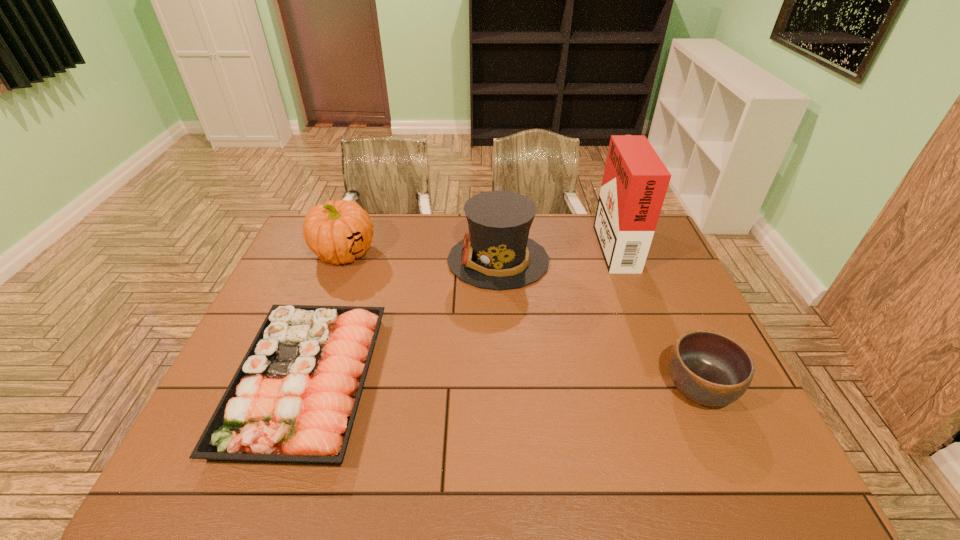
Where is `vacant area situated 0.060m with goggles on the front of the third object from left to right`? vacant area situated 0.060m with goggles on the front of the third object from left to right is located at coordinates (429, 260).

Find the location of `blank area located on the surface of the pumpkin`. blank area located on the surface of the pumpkin is located at coordinates (305, 356).

At what (x,y) coordinates should I click in order to perform the action: click on blank space located 0.170m on the back of the bowl. Please return your answer as a coordinate pair (x, y). Image resolution: width=960 pixels, height=540 pixels. Looking at the image, I should click on (666, 314).

I want to click on vacant space located 0.170m on the right of the shortest object, so coord(439,381).

Find the location of a particular element. This screenshot has height=540, width=960. cigarette case that is at the far edge is located at coordinates (635, 181).

Find the location of a particular element. The image size is (960, 540). dress hat positioned at the far edge is located at coordinates (497, 254).

The width and height of the screenshot is (960, 540). I want to click on pumpkin at the far edge, so click(337, 232).

Where is `object present at the near edge`? object present at the near edge is located at coordinates (293, 399).

At what (x,y) coordinates should I click in order to perform the action: click on pumpkin located in the left edge section of the desktop. Please return your answer as a coordinate pair (x, y). This screenshot has height=540, width=960. Looking at the image, I should click on (337, 232).

At what (x,y) coordinates should I click in order to perform the action: click on platter located in the left edge section of the desktop. Please return your answer as a coordinate pair (x, y). This screenshot has height=540, width=960. Looking at the image, I should click on pyautogui.click(x=293, y=399).